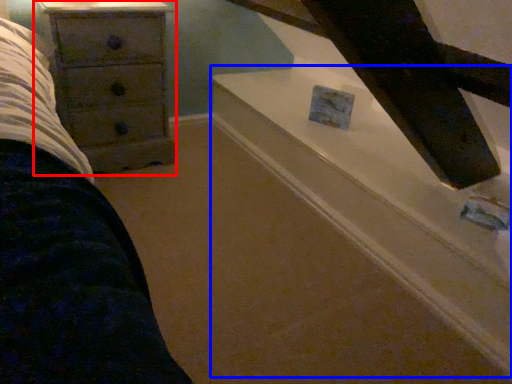
Question: Which point is further to the camera, chest of drawers (highlighted by a red box) or stairwell (highlighted by a blue box)?

Choices:
 (A) chest of drawers
 (B) stairwell

Answer: (A)